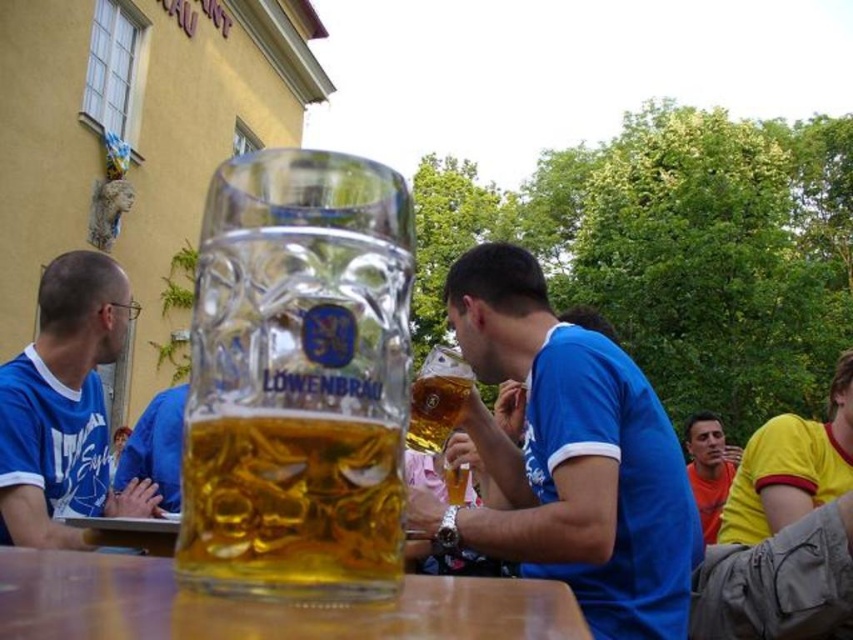
You are a photographer at the event and want to take a photo that includes both the yellow jersey at right and the translucent glass mug at center. Which object should you focus on first if you want to ensure both are in frame without moving the camera?

The yellow jersey at right is larger in size than the translucent glass mug at center, so you should focus on the yellow jersey at right first to ensure both fit in the frame.

Based on the photo, you are a photographer standing at the back of the beer garden. You want to take a photo that includes both the blue jersey shirt at center and the blue jersey at left. Given that your camera has a maximum focus range of 4 meters, will both subjects be in focus?

The blue jersey shirt at center is 4.25 meters away from the blue jersey at left. Since the distance between them is beyond the camera focus range of 4 meters, both subjects may not be in focus simultaneously.